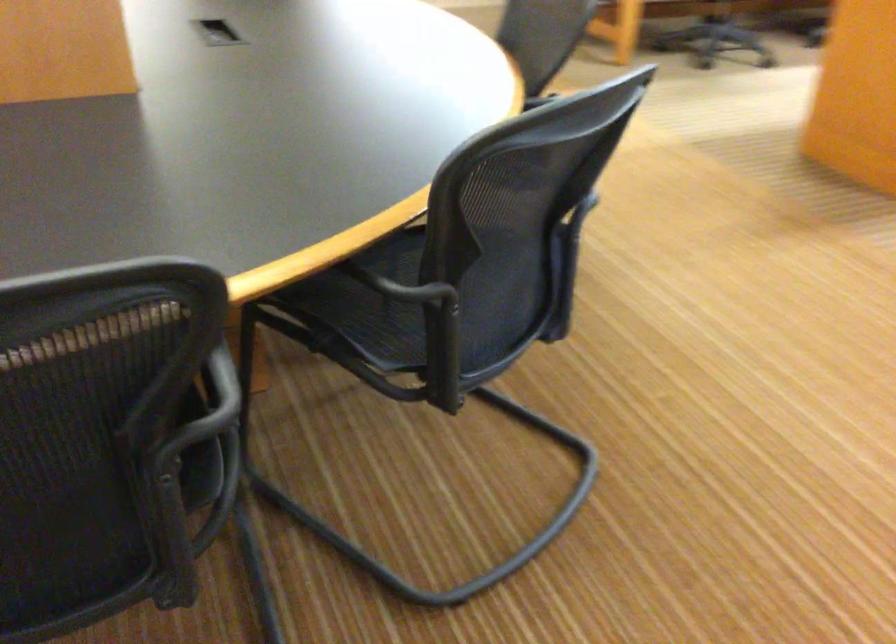
Find where to sit the black chair sitting surface. Please return your answer as a coordinate pair (x, y).

(386, 301)